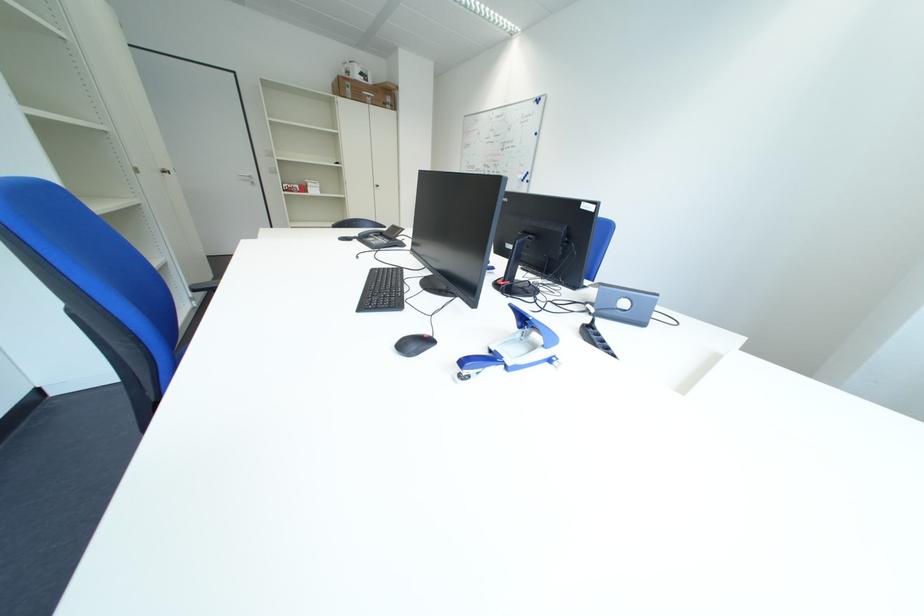
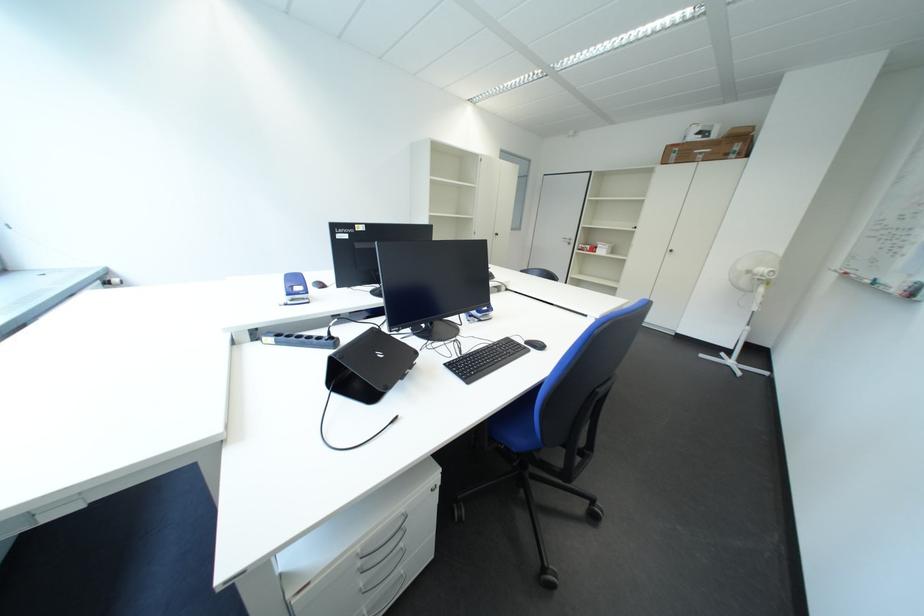
Where in the second image is the point corresponding to pixel 400 102 from the first image?

(748, 150)